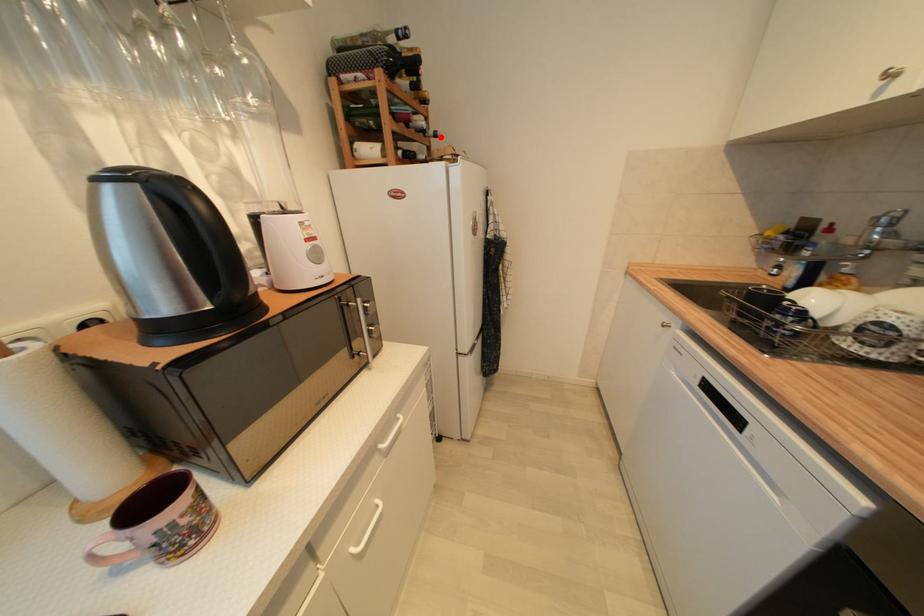
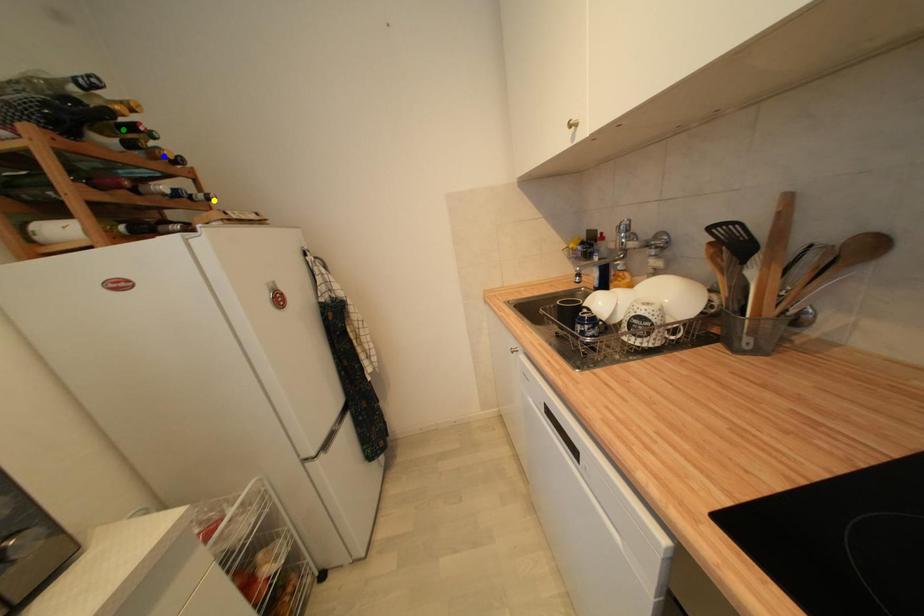
Question: I am providing you with two images of the same scene from different viewpoints. A red point is marked on the first image. You are given multiple points on the second image. Which point in image 2 is actually the same real-world point as the red point in image 1?

Choices:
 (A) yellow point
 (B) green point
 (C) blue point

Answer: (A)